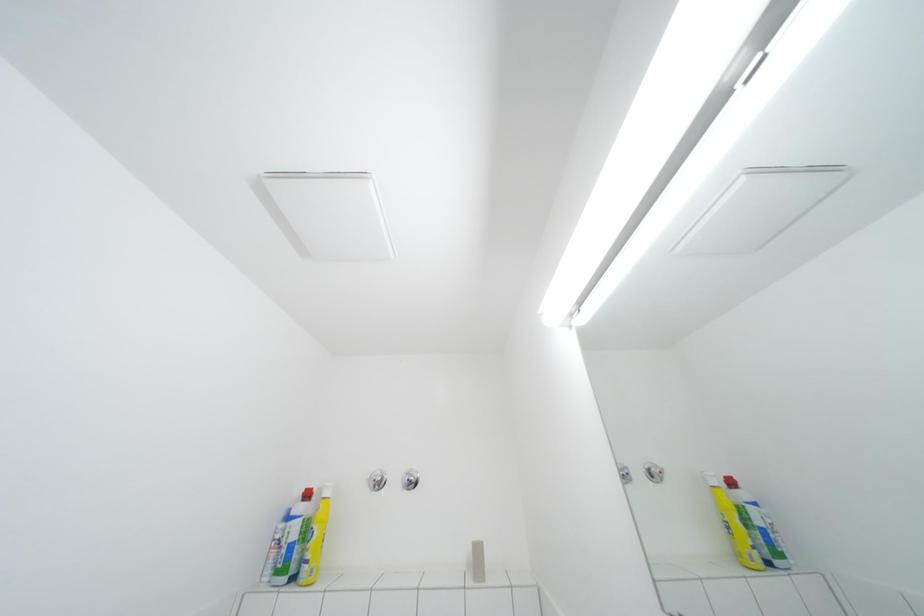
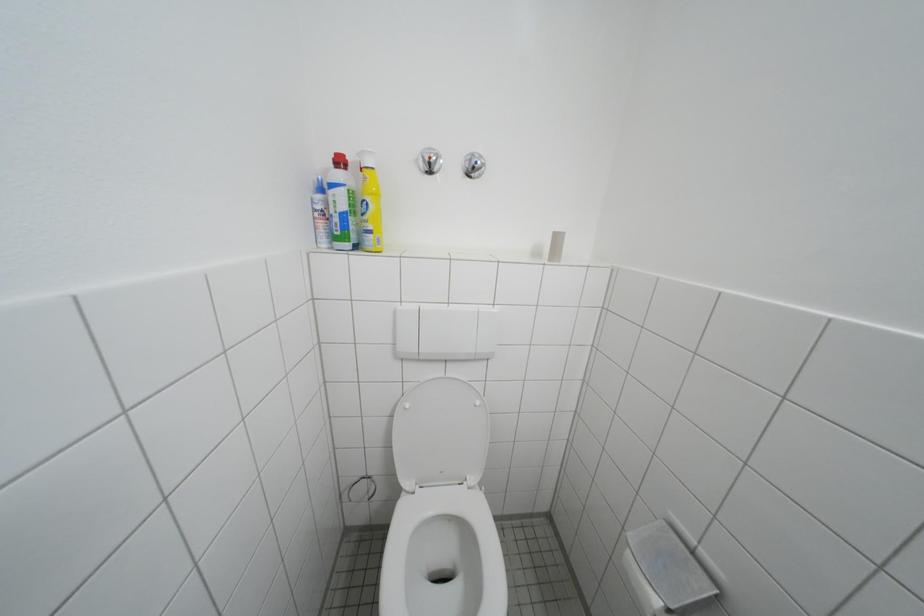
Question: Based on the continuous images, in which direction is the camera rotating? Reply with the corresponding letter.

Choices:
 (A) Left
 (B) Right
 (C) Up
 (D) Down

Answer: (D)